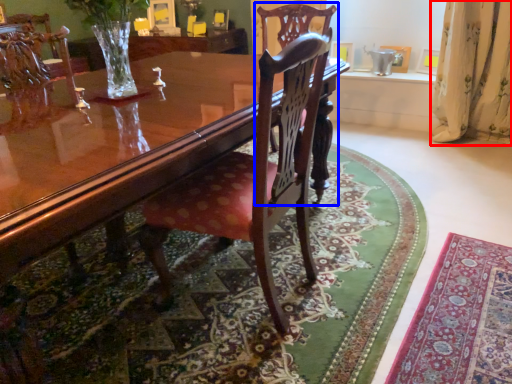
Question: Which object appears closest to the camera in this image, curtain (highlighted by a red box) or chair (highlighted by a blue box)?

Choices:
 (A) curtain
 (B) chair

Answer: (B)